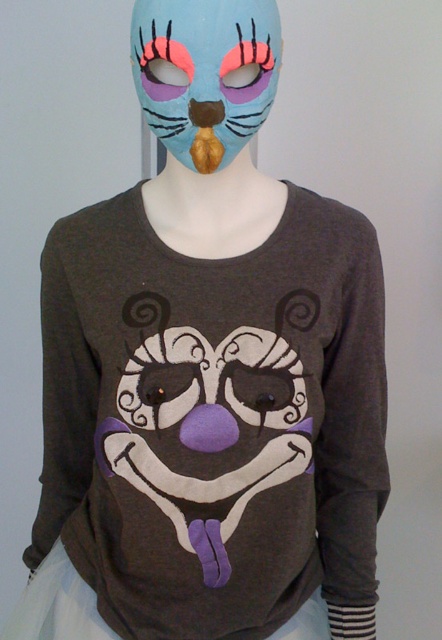
Does matte gray sweatshirt at center have a greater height compared to matte blue mask at upper center?

Indeed, matte gray sweatshirt at center has a greater height compared to matte blue mask at upper center.

Does matte gray sweatshirt at center have a larger size compared to matte blue mask at upper center?

Correct, matte gray sweatshirt at center is larger in size than matte blue mask at upper center.

Who is more forward, (168, 388) or (144, 90)?

Point (144, 90) is more forward.

The image size is (442, 640). Identify the location of matte gray sweatshirt at center. (213, 419).